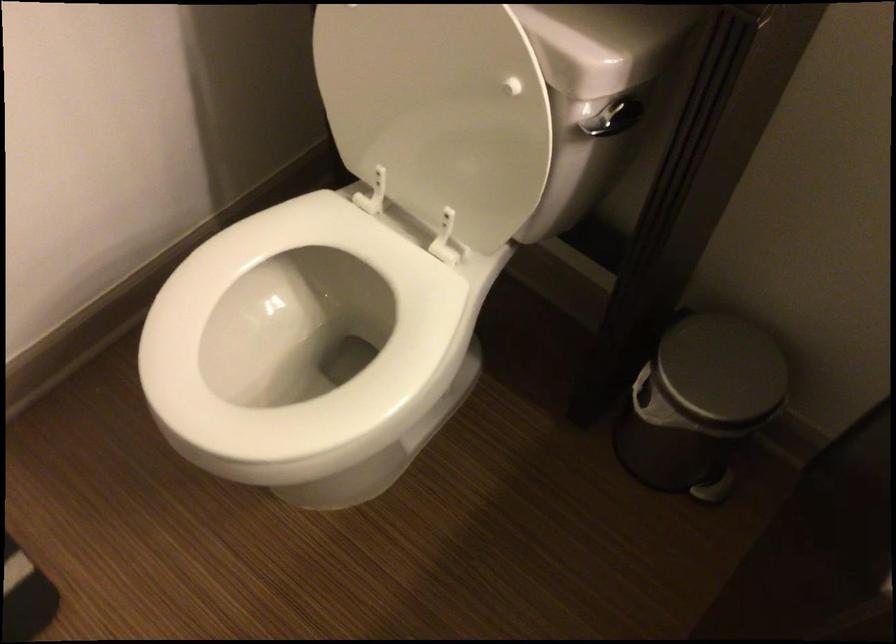
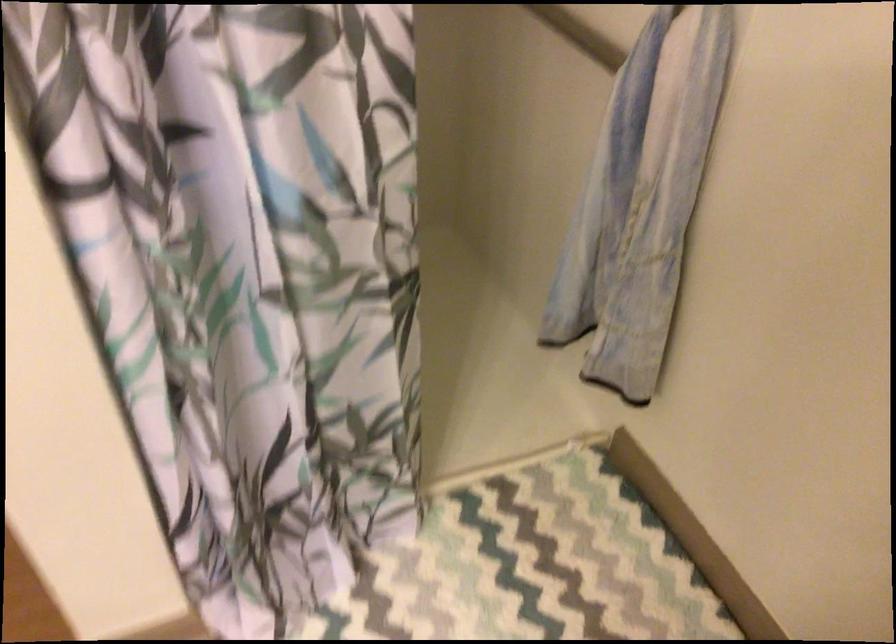
The images are taken continuously from a first-person perspective. In which direction is your viewpoint rotating?

The camera rotated toward left-down.